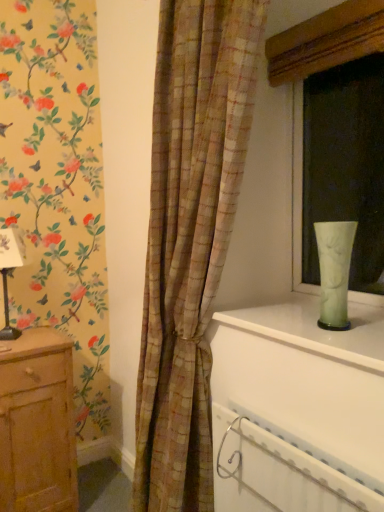
Locate an element on the screen. The width and height of the screenshot is (384, 512). vacant space underneath matte black table lamp at left (from a real-world perspective) is located at coordinates (15, 337).